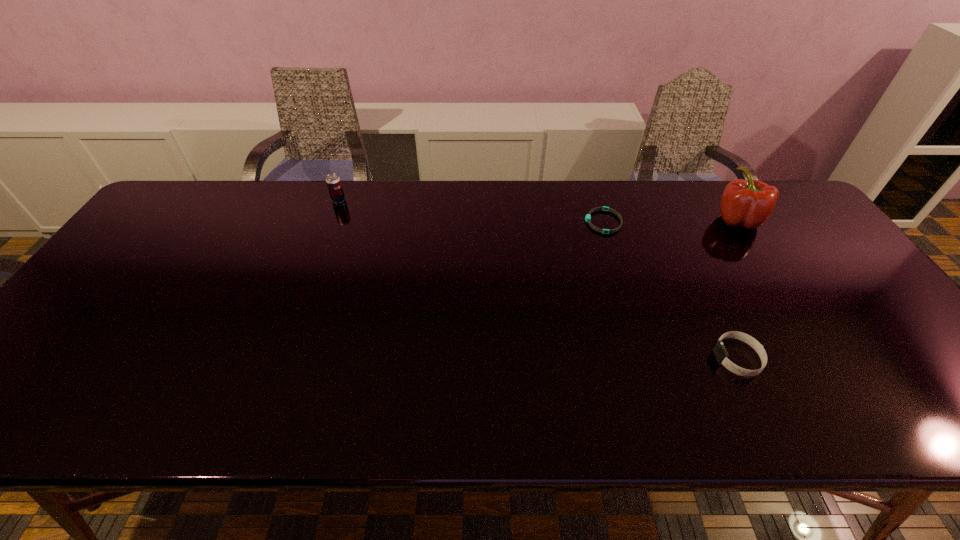
The height and width of the screenshot is (540, 960). I want to click on empty location between the tallest object and the third shortest object, so click(538, 210).

The height and width of the screenshot is (540, 960). Identify the location of vacant area between the taller wristband and the beer can. (539, 279).

At what (x,y) coordinates should I click in order to perform the action: click on vacant space in between the second object from right to left and the tallest object. Please return your answer as a coordinate pair (x, y). This screenshot has height=540, width=960. Looking at the image, I should click on (737, 289).

At what (x,y) coordinates should I click in order to perform the action: click on vacant space that is in between the right wristband and the beer can. Please return your answer as a coordinate pair (x, y). Looking at the image, I should click on 539,279.

Where is `empty space that is in between the nearer wristband and the farthest object`? The image size is (960, 540). empty space that is in between the nearer wristband and the farthest object is located at coordinates (539, 279).

At what (x,y) coordinates should I click in order to perform the action: click on free spot between the rightmost object and the leftmost object. Please return your answer as a coordinate pair (x, y). Image resolution: width=960 pixels, height=540 pixels. Looking at the image, I should click on [538, 210].

Locate an element on the screen. The width and height of the screenshot is (960, 540). vacant area between the left wristband and the nearest object is located at coordinates [x=670, y=290].

At what (x,y) coordinates should I click in order to perform the action: click on object identified as the closest to the pepper. Please return your answer as a coordinate pair (x, y). Looking at the image, I should click on point(588,217).

Locate which object ranks in proximity to the second object from right to left. Please provide its 2D coordinates. Your answer should be formatted as a tuple, i.e. [(x, y)], where the tuple contains the x and y coordinates of a point satisfying the conditions above.

[(749, 203)]

Locate an element on the screen. Image resolution: width=960 pixels, height=540 pixels. vacant space that satisfies the following two spatial constraints: 1. on the front side of the pepper; 2. on the buckle of the third object from right to left is located at coordinates (738, 221).